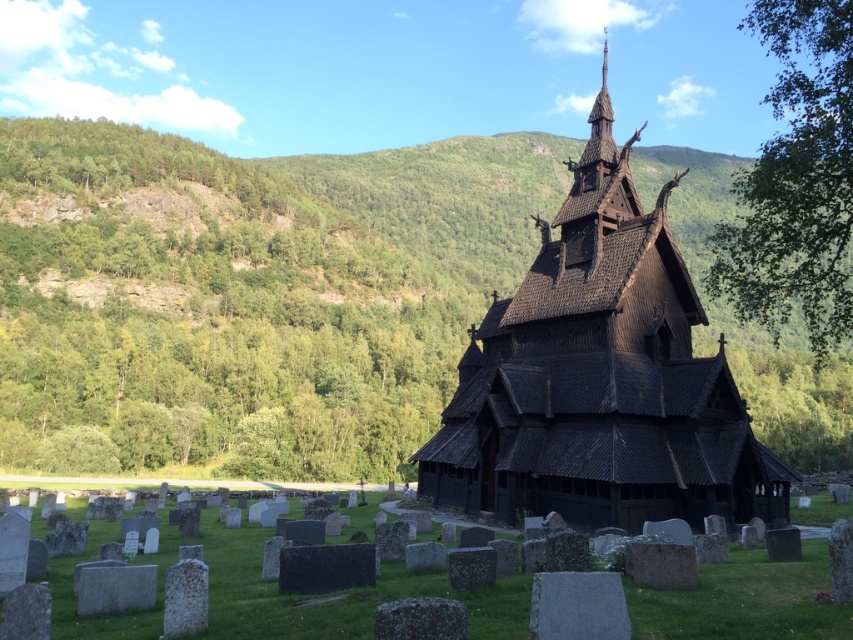
Question: Which object is the farthest from the green leafy hillside at upper left?

Choices:
 (A) black wooden church at center
 (B) green leafy tree at upper right

Answer: (A)

Question: Which point is farther from the camera taking this photo?

Choices:
 (A) (809, 131)
 (B) (157, 244)
 (C) (689, 444)

Answer: (B)

Question: Does green leafy hillside at upper left appear under green leafy tree at upper right?

Choices:
 (A) no
 (B) yes

Answer: (B)

Question: Can you confirm if green leafy hillside at upper left is smaller than black wooden church at center?

Choices:
 (A) yes
 (B) no

Answer: (B)

Question: Does green leafy hillside at upper left have a smaller size compared to black wooden church at center?

Choices:
 (A) yes
 (B) no

Answer: (B)

Question: Which object is farther from the camera taking this photo?

Choices:
 (A) green leafy tree at upper right
 (B) green leafy hillside at upper left

Answer: (B)